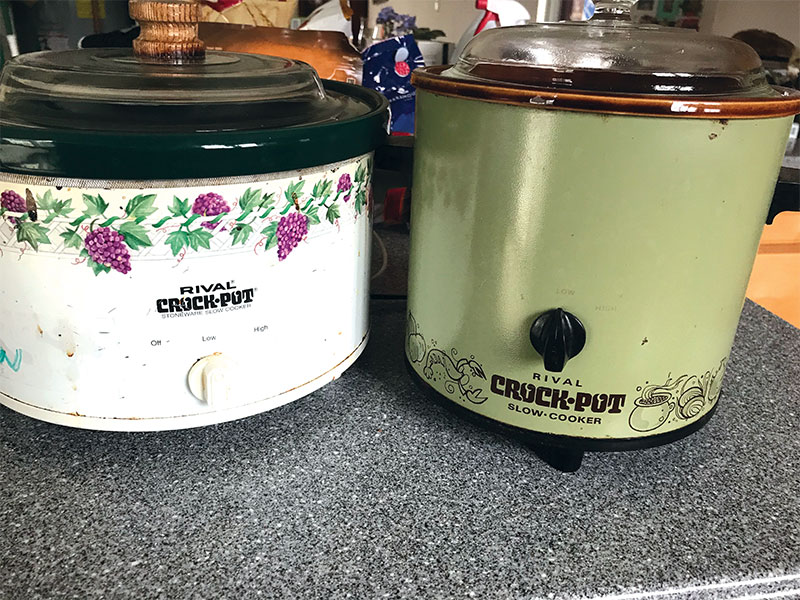
The image size is (800, 600). Find the location of `pot logo on crock pot`. pot logo on crock pot is located at coordinates (657, 412).